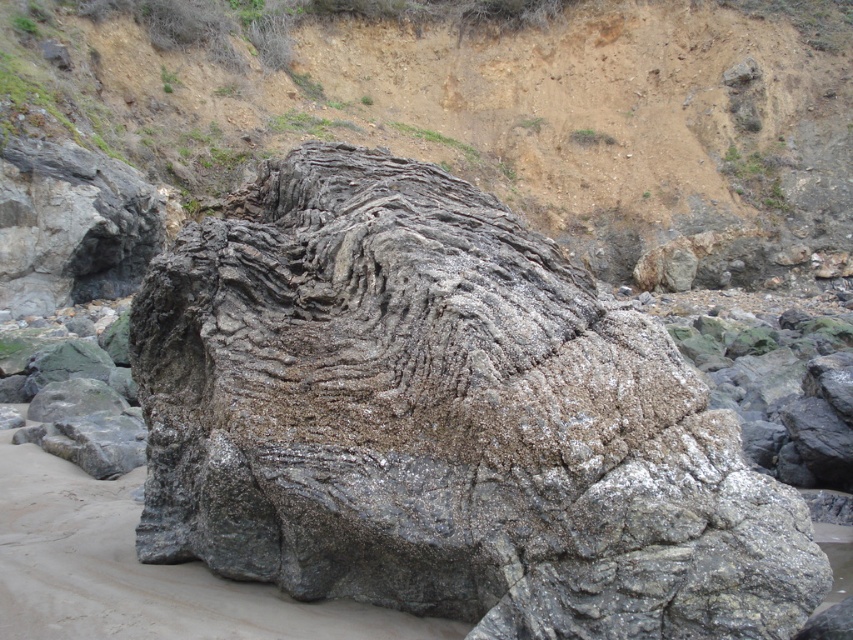
Question: Which of the following is the farthest from the observer?

Choices:
 (A) dull brown rock at center
 (B) gray rough rock at center

Answer: (A)

Question: Among these objects, which one is nearest to the camera?

Choices:
 (A) gray rough rock at center
 (B) dull brown rock at center

Answer: (A)

Question: Is gray rough rock at center in front of dull brown rock at center?

Choices:
 (A) no
 (B) yes

Answer: (B)

Question: Is gray rough rock at center bigger than dull brown rock at center?

Choices:
 (A) yes
 (B) no

Answer: (B)

Question: Can you confirm if gray rough rock at center is thinner than dull brown rock at center?

Choices:
 (A) no
 (B) yes

Answer: (B)

Question: Which of the following is the closest to the observer?

Choices:
 (A) (141, 557)
 (B) (212, 161)

Answer: (A)